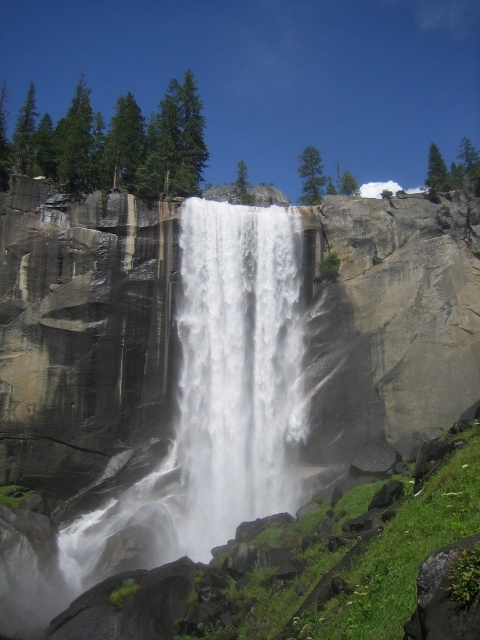
You are standing at the edge of the waterfall and want to place a small weatherproof camera at point (210, 365). According to the scene description, what type of surface will the camera be placed on?

The surface at point (210, 365) is a gray rough rock face at center, so the camera will be placed on the gray rough rock face at center.